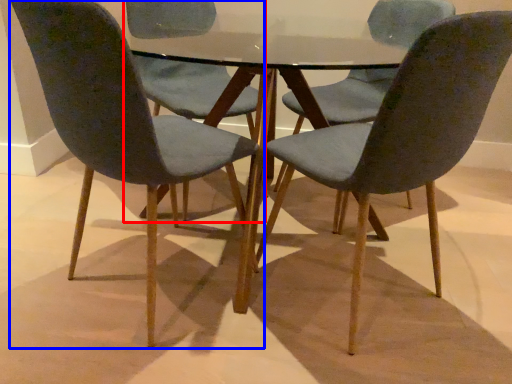
Question: Among these objects, which one is farthest to the camera, chair (highlighted by a red box) or chair (highlighted by a blue box)?

Choices:
 (A) chair
 (B) chair

Answer: (A)